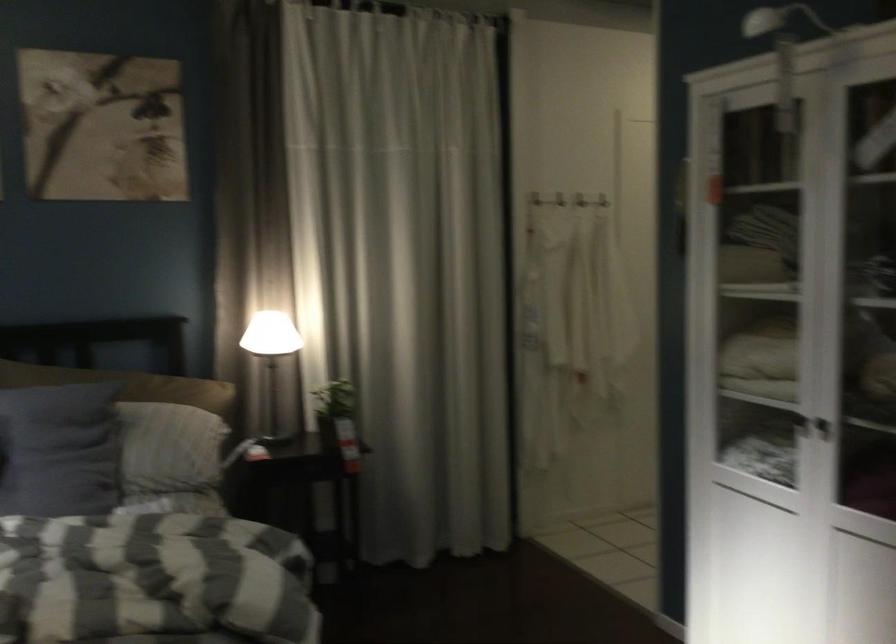
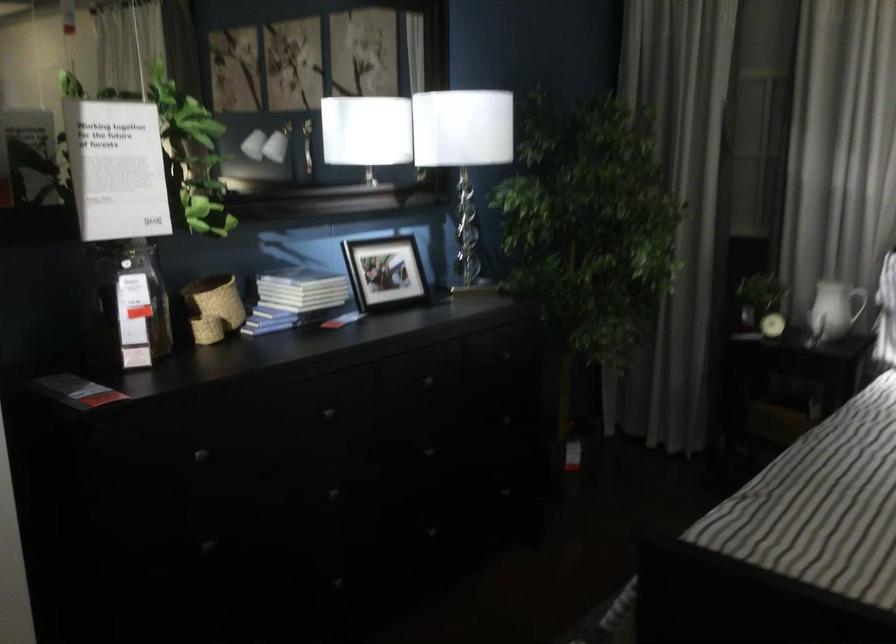
Question: The camera is either moving clockwise (left) or counter-clockwise (right) around the object. The first image is from the beginning of the video and the second image is from the end. Is the camera moving left or right when shooting the video?

Choices:
 (A) Left
 (B) Right

Answer: (B)